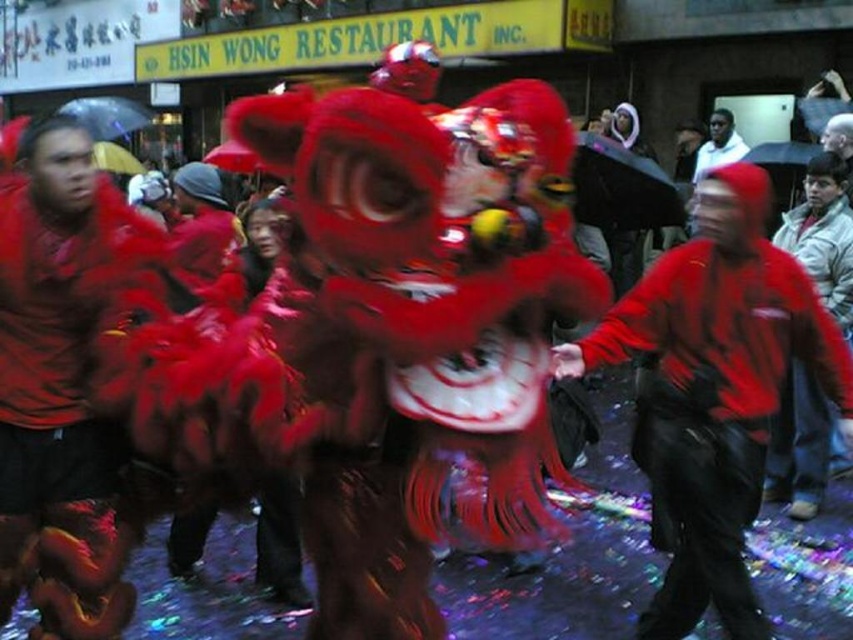
You are a photographer at the event and want to capture both the velvet red lion at center and the white cotton hoodie at upper center in a single frame. Considering their sizes, which object should you focus on to ensure both are visible without cropping?

The velvet red lion at center is larger in size than the white cotton hoodie at upper center, so you should focus on the velvet red lion at center to accommodate its larger size while still including the smaller white cotton hoodie at upper center in the frame.

You are a photographer at the event and want to capture a photo where the velvet red lion at center is framed prominently without the white cotton hoodie at upper center appearing too large in the foreground. Should you move closer or farther away from the lion?

To ensure the velvet red lion at center remains the prominent focus and the white cotton hoodie at upper center does not appear too large, you should move farther away from the lion. This will reduce the relative size of both objects in the frame, but since the velvet red lion at center is taller, it will still dominate the composition.

Consider the image. You are a photographer trying to capture the lion dance performance. You notice the velvet red lion at center and the white cotton hoodie at upper center. Which object is positioned closer to your camera lens?

The velvet red lion at center is closer to the viewer than the white cotton hoodie at upper center, so the velvet red lion at center is positioned closer to your camera lens.